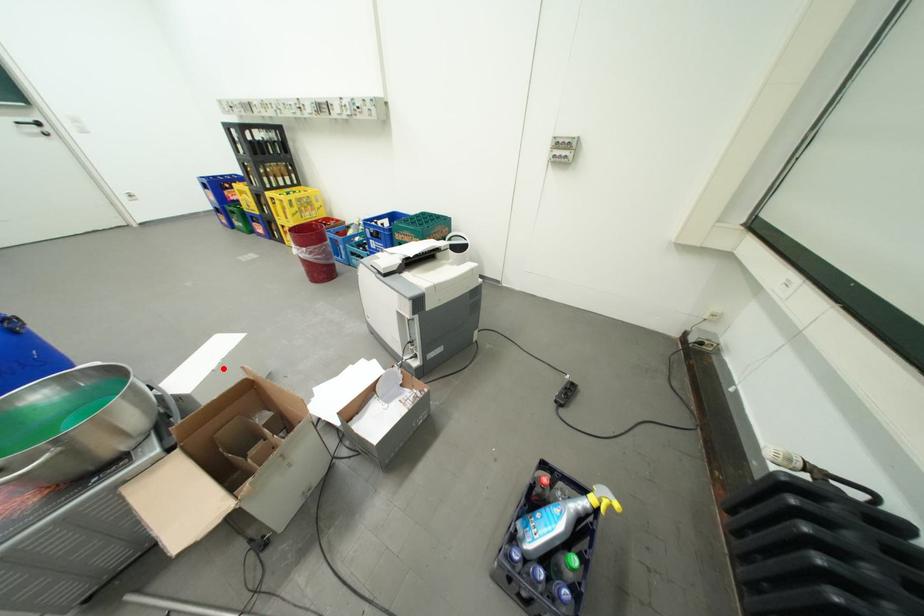
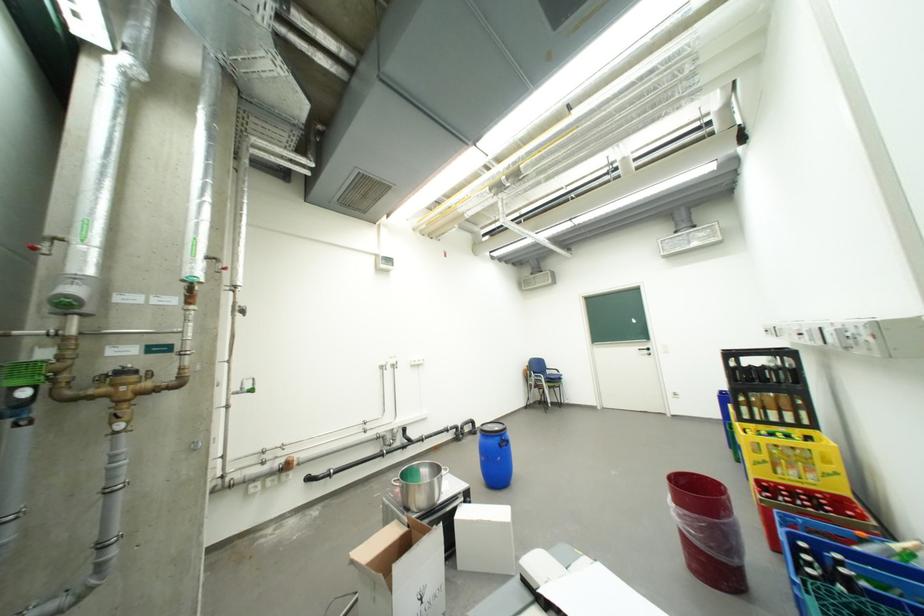
Question: I am providing you with two images of the same scene from different viewpoints. Given a red point in image1, look at the same physical point in image2. Is it:

Choices:
 (A) Closer to the viewpoint
 (B) Farther from the viewpoint

Answer: (A)